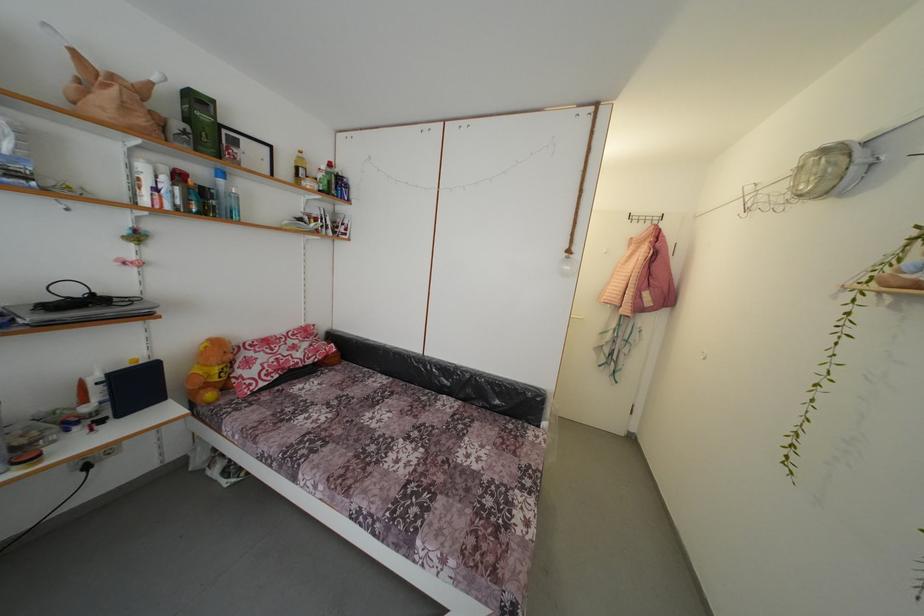
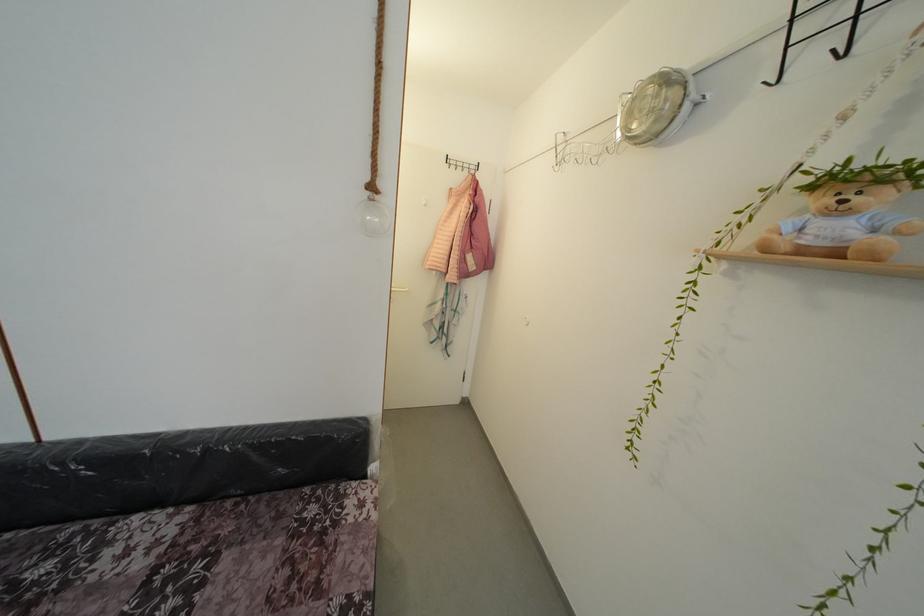
Find the pixel in the second image that matches (572,261) in the first image.

(373, 199)